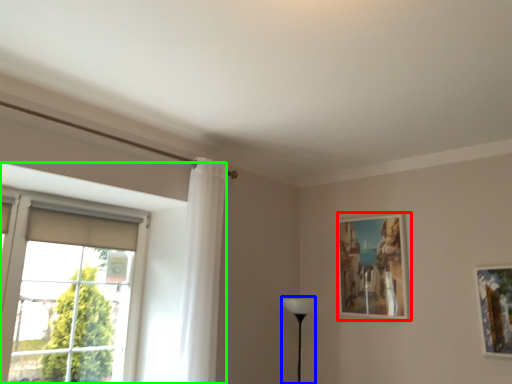
Question: Which object is the closest to the picture frame (highlighted by a red box)? Choose among these: table lamp (highlighted by a blue box) or window (highlighted by a green box).

Choices:
 (A) table lamp
 (B) window

Answer: (A)